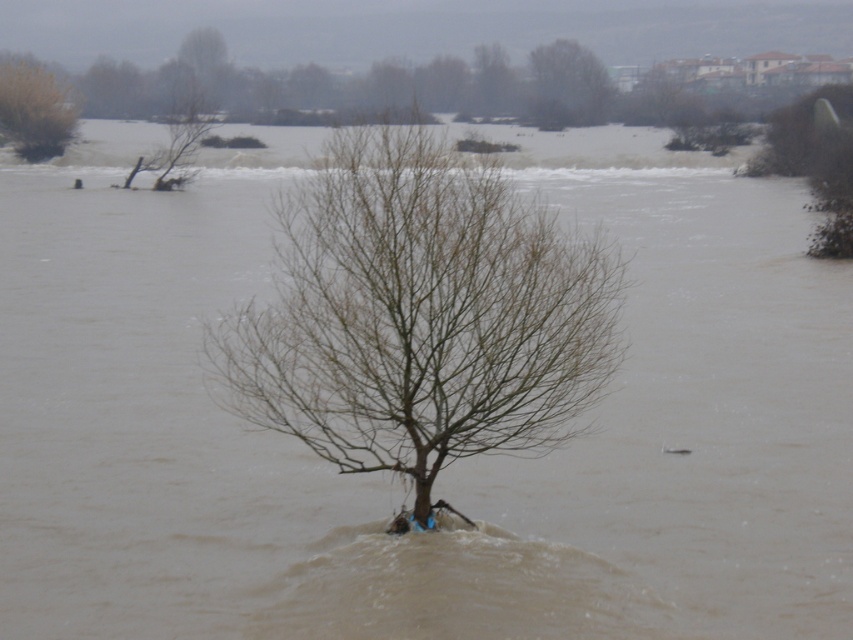
You are a photographer trying to capture the brown matte tree at center and the brown leafless tree at upper left in the same frame. Can you see both trees clearly from your current position?

Yes, the brown matte tree at center is in front of the brown leafless tree at upper left, so both can be seen clearly in the same frame.

You are a bird looking for a place to land. You see a brown leafless tree at upper left and bare branches at upper center. Which one is closer to the water surface?

The brown leafless tree at upper left is positioned under bare branches at upper center, meaning it is closer to the water surface.

You are a photographer trying to capture the flooded landscape. You notice the brown matte tree at center and the brown leafless tree at upper left. Which tree would appear closer to your camera based on their sizes?

The brown matte tree at center appears closer to the camera because it has a larger size compared to the brown leafless tree at upper left.